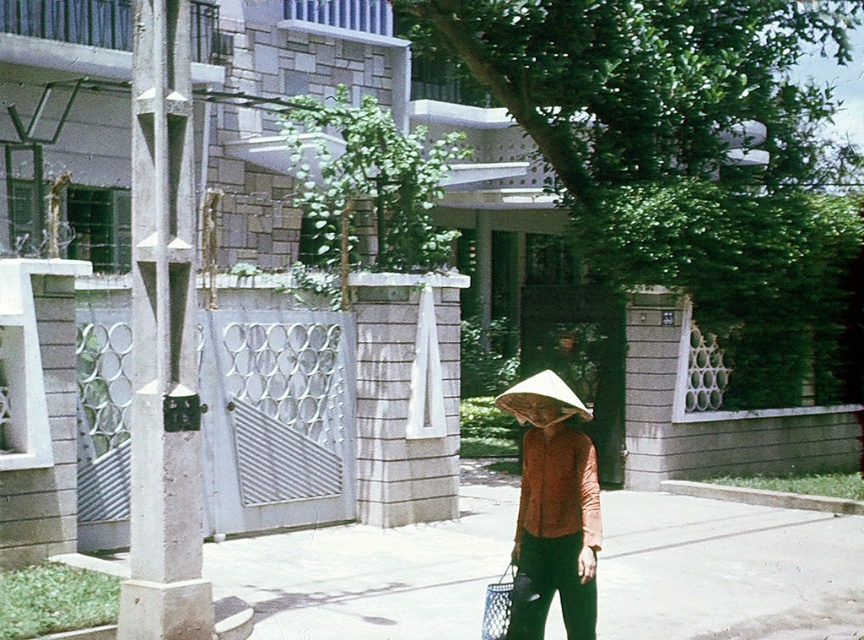
Question: Is smooth concrete pavement at center behind white straw hat at center?

Choices:
 (A) no
 (B) yes

Answer: (B)

Question: Which of the following is the closest to the observer?

Choices:
 (A) (531, 467)
 (B) (548, 396)

Answer: (B)

Question: Can you confirm if smooth concrete pavement at center is positioned below matte brown conical hat at center?

Choices:
 (A) yes
 (B) no

Answer: (A)

Question: Can you confirm if smooth concrete pavement at center is smaller than white straw hat at center?

Choices:
 (A) yes
 (B) no

Answer: (A)

Question: Which point is farther to the camera?

Choices:
 (A) smooth concrete pavement at center
 (B) matte brown conical hat at center
 (C) white straw hat at center

Answer: (A)

Question: Which of the following is the closest to the observer?

Choices:
 (A) (595, 589)
 (B) (791, 588)

Answer: (A)